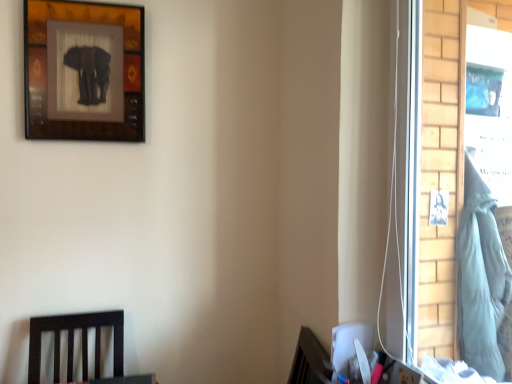
Question: Can you confirm if wooden elephant art at upper left is thinner than light blue fabric at right?

Choices:
 (A) yes
 (B) no

Answer: (A)

Question: Can you confirm if wooden elephant art at upper left is taller than light blue fabric at right?

Choices:
 (A) no
 (B) yes

Answer: (A)

Question: Can you confirm if wooden elephant art at upper left is bigger than light blue fabric at right?

Choices:
 (A) no
 (B) yes

Answer: (A)

Question: Is there a large distance between wooden elephant art at upper left and light blue fabric at right?

Choices:
 (A) no
 (B) yes

Answer: (B)

Question: Is wooden elephant art at upper left at the right side of light blue fabric at right?

Choices:
 (A) yes
 (B) no

Answer: (B)

Question: Does wooden elephant art at upper left have a lesser height compared to light blue fabric at right?

Choices:
 (A) yes
 (B) no

Answer: (A)

Question: Does light blue fabric at right lie behind wooden elephant art at upper left?

Choices:
 (A) no
 (B) yes

Answer: (B)

Question: From a real-world perspective, does light blue fabric at right stand above wooden elephant art at upper left?

Choices:
 (A) no
 (B) yes

Answer: (A)

Question: Is wooden elephant art at upper left located within light blue fabric at right?

Choices:
 (A) no
 (B) yes

Answer: (A)

Question: Is the depth of light blue fabric at right less than that of wooden elephant art at upper left?

Choices:
 (A) no
 (B) yes

Answer: (A)

Question: Can you confirm if light blue fabric at right is taller than wooden elephant art at upper left?

Choices:
 (A) yes
 (B) no

Answer: (A)

Question: From the image's perspective, is light blue fabric at right over wooden elephant art at upper left?

Choices:
 (A) no
 (B) yes

Answer: (A)

Question: Is wooden elephant art at upper left taller or shorter than light blue fabric at right?

Choices:
 (A) tall
 (B) short

Answer: (B)